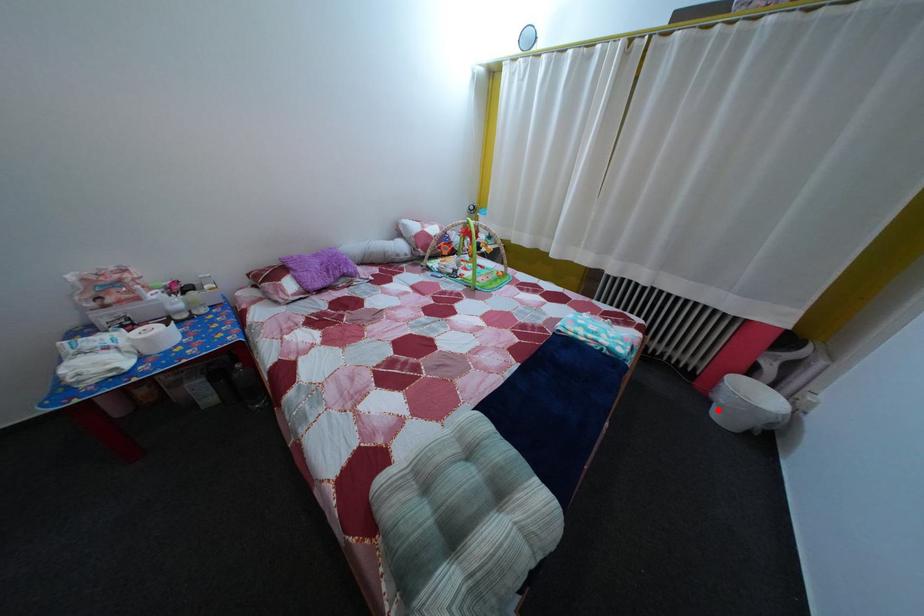
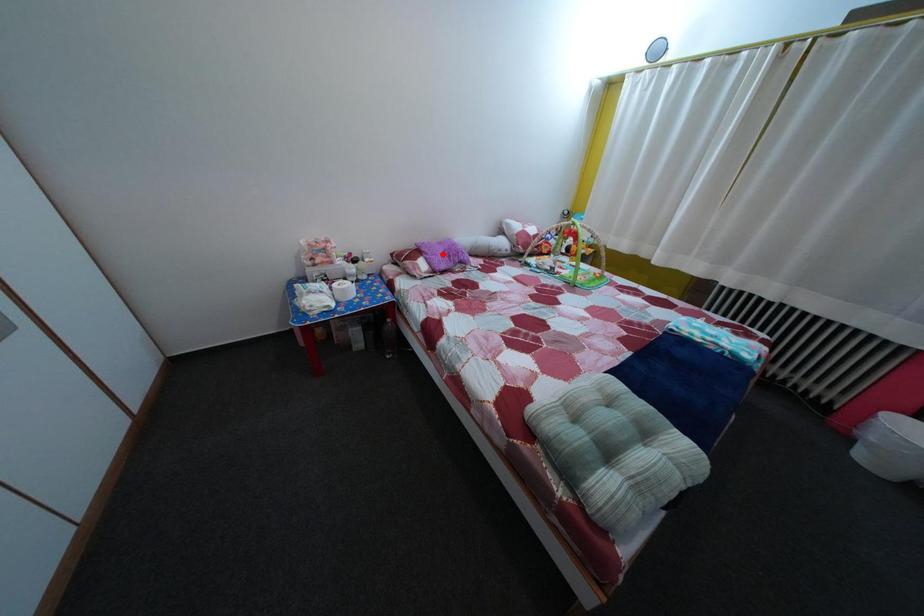
I am providing you with two images of the same scene from different viewpoints. A red point is marked on the first image and another point is marked on the second image. Is the marked point in image1 the same physical position as the marked point in image2?

No